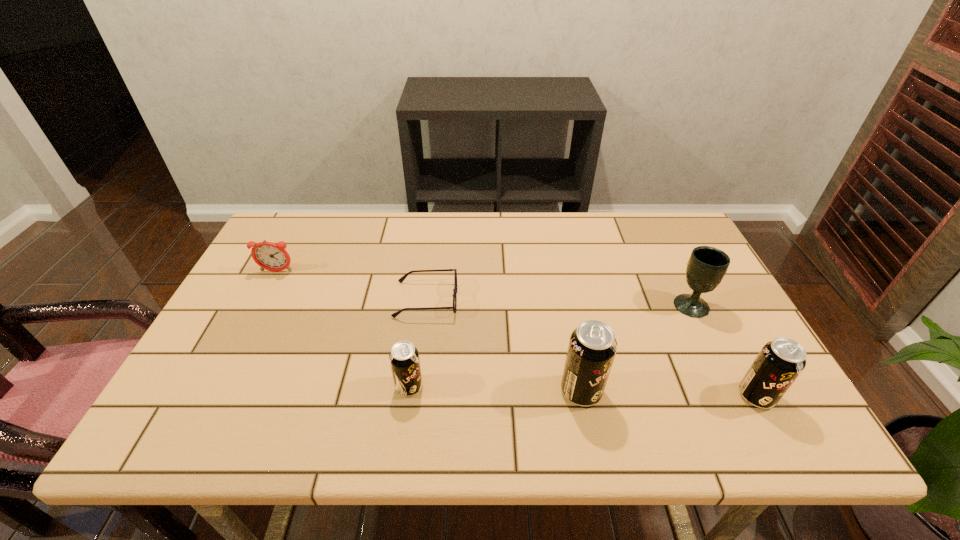
Identify the location of free area in between the shortest object and the chalice. The height and width of the screenshot is (540, 960). pos(559,302).

You are a GUI agent. You are given a task and a screenshot of the screen. Output one action in this format:
    pyautogui.click(x=<x>, y=<y>)
    Task: Click on the free space between the leftmost object and the second soda can from left to right
    The width and height of the screenshot is (960, 540).
    Given the screenshot: What is the action you would take?
    pyautogui.click(x=429, y=331)

At what (x,y) coordinates should I click in order to perform the action: click on free space that is in between the shortest soda can and the chalice. Please return your answer as a coordinate pair (x, y). The height and width of the screenshot is (540, 960). Looking at the image, I should click on (550, 346).

This screenshot has width=960, height=540. What are the coordinates of `empty space that is in between the leftmost object and the fourth object from left to right` in the screenshot? It's located at (429, 331).

Locate which object ranks in proximity to the fourth object from left to right. Please provide its 2D coordinates. Your answer should be formatted as a tuple, i.e. [(x, y)], where the tuple contains the x and y coordinates of a point satisfying the conditions above.

[(401, 279)]

Identify which object is located as the fifth nearest to the leftmost soda can. Please provide its 2D coordinates. Your answer should be formatted as a tuple, i.e. [(x, y)], where the tuple contains the x and y coordinates of a point satisfying the conditions above.

[(779, 363)]

The image size is (960, 540). In order to click on soda can that stands as the closest to the second shortest soda can in this screenshot , I will do `click(592, 347)`.

Where is `soda can that is the second closest to the chalice`? soda can that is the second closest to the chalice is located at coordinates (592, 347).

The width and height of the screenshot is (960, 540). In order to click on blank area in the image that satisfies the following two spatial constraints: 1. on the front-facing side of the spectacles; 2. on the back side of the rightmost soda can in this screenshot , I will do `click(414, 396)`.

Where is `blank space that satisfies the following two spatial constraints: 1. on the front-facing side of the spectacles; 2. on the front side of the shortest soda can`? Image resolution: width=960 pixels, height=540 pixels. blank space that satisfies the following two spatial constraints: 1. on the front-facing side of the spectacles; 2. on the front side of the shortest soda can is located at coordinates (415, 387).